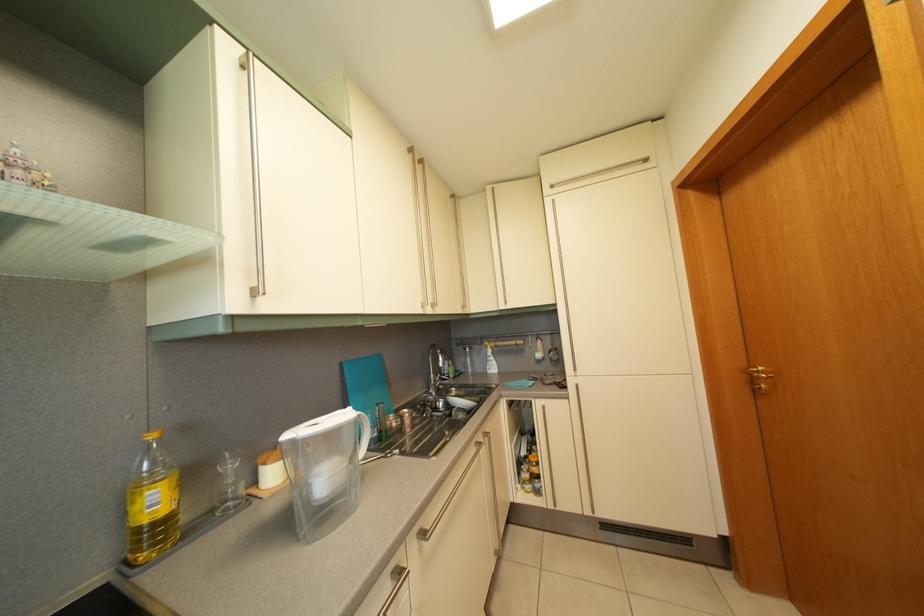
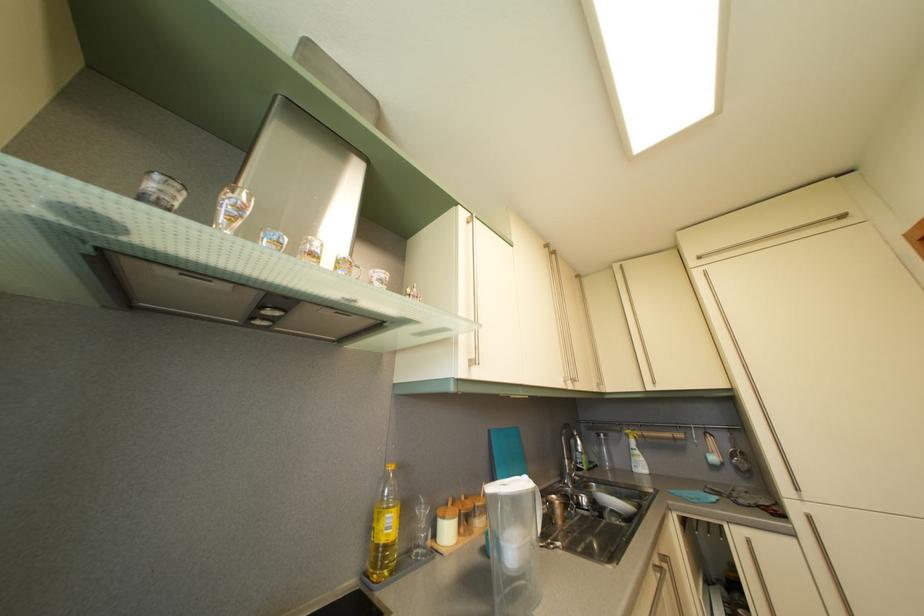
Locate, in the second image, the point that corresponds to (x=442, y=353) in the first image.

(575, 432)